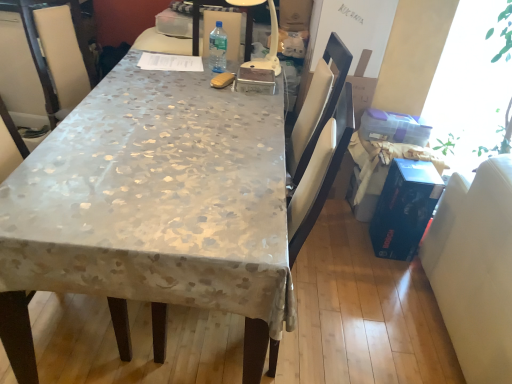
Question: Can you confirm if clear plastic bottle at center is shorter than silky beige tablecloth at center?

Choices:
 (A) no
 (B) yes

Answer: (B)

Question: Is clear plastic bottle at center wider than silky beige tablecloth at center?

Choices:
 (A) no
 (B) yes

Answer: (A)

Question: Is clear plastic bottle at center positioned in front of silky beige tablecloth at center?

Choices:
 (A) no
 (B) yes

Answer: (A)

Question: Is clear plastic bottle at center positioned far away from silky beige tablecloth at center?

Choices:
 (A) yes
 (B) no

Answer: (B)

Question: From a real-world perspective, is clear plastic bottle at center on silky beige tablecloth at center?

Choices:
 (A) yes
 (B) no

Answer: (A)

Question: Relative to silky beige tablecloth at center, is clear plastic bottle at center in front or behind?

Choices:
 (A) front
 (B) behind

Answer: (B)

Question: Considering the positions of clear plastic bottle at center and silky beige tablecloth at center in the image, is clear plastic bottle at center taller or shorter than silky beige tablecloth at center?

Choices:
 (A) tall
 (B) short

Answer: (B)

Question: In the image, is clear plastic bottle at center on the left side or the right side of silky beige tablecloth at center?

Choices:
 (A) left
 (B) right

Answer: (B)

Question: Is point (223, 51) closer or farther from the camera than point (78, 206)?

Choices:
 (A) closer
 (B) farther

Answer: (B)

Question: Based on their positions, is white leather swivel chair at right located to the left or right of blue cardboard box at right?

Choices:
 (A) right
 (B) left

Answer: (A)

Question: From the image's perspective, is white leather swivel chair at right positioned above or below blue cardboard box at right?

Choices:
 (A) above
 (B) below

Answer: (B)

Question: Considering the positions of white leather swivel chair at right and blue cardboard box at right in the image, is white leather swivel chair at right wider or thinner than blue cardboard box at right?

Choices:
 (A) wide
 (B) thin

Answer: (A)

Question: Is point (464, 201) positioned closer to the camera than point (415, 246)?

Choices:
 (A) closer
 (B) farther

Answer: (A)

Question: Relative to white leather swivel chair at right, is clear plastic bottle at center in front or behind?

Choices:
 (A) behind
 (B) front

Answer: (A)

Question: From the image's perspective, is clear plastic bottle at center positioned above or below white leather swivel chair at right?

Choices:
 (A) below
 (B) above

Answer: (B)